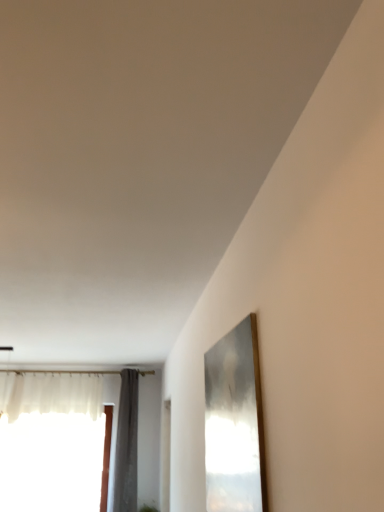
Question: Looking at the image, does gray fabric curtain at left seem bigger or smaller compared to translucent fabric window at left?

Choices:
 (A) small
 (B) big

Answer: (A)

Question: From the image's perspective, is gray fabric curtain at left positioned above or below translucent fabric window at left?

Choices:
 (A) below
 (B) above

Answer: (B)

Question: Which is correct: gray fabric curtain at left is inside translucent fabric window at left, or outside of it?

Choices:
 (A) outside
 (B) inside

Answer: (A)

Question: In the image, is translucent fabric window at left positioned in front of or behind gray fabric curtain at left?

Choices:
 (A) front
 (B) behind

Answer: (B)

Question: Would you say translucent fabric window at left is inside or outside gray fabric curtain at left?

Choices:
 (A) outside
 (B) inside

Answer: (A)

Question: From their relative heights in the image, would you say translucent fabric window at left is taller or shorter than gray fabric curtain at left?

Choices:
 (A) tall
 (B) short

Answer: (B)

Question: From the image's perspective, is translucent fabric window at left located above or below gray fabric curtain at left?

Choices:
 (A) below
 (B) above

Answer: (A)